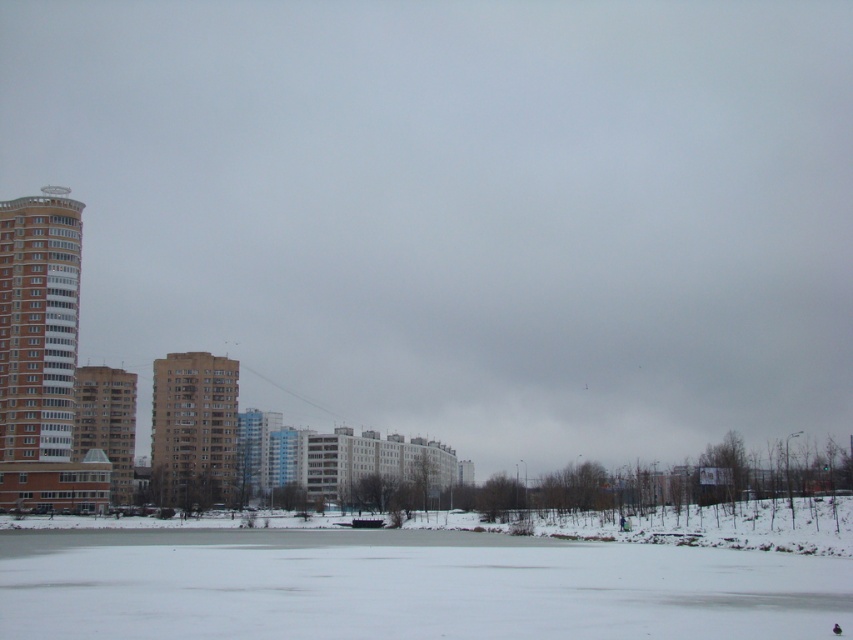
Based on the photo, you are a delivery drone that needs to fly between the brown glossy building at left and the brown brick building at center. The minimum safe distance between your drone and any building is 5 meters. Can you fly directly between them without violating the safety distance?

The distance between the brown glossy building at left and the brown brick building at center is 33.55 meters. Since the minimum safe distance required is 5 meters from each building, the total required space would be 5 meters on each side, totaling 10 meters. Since 33.55 meters is greater than 10 meters, the drone can safely fly between them while maintaining the required distance.

You are an architect analyzing the winter scene. You need to determine which of the two buildings, the brown glossy building at left or the brown brick building at center, has a greater overall size. Based on the scene description, which building is larger?

The brown glossy building at left is larger in size than the brown brick building at center according to the description.